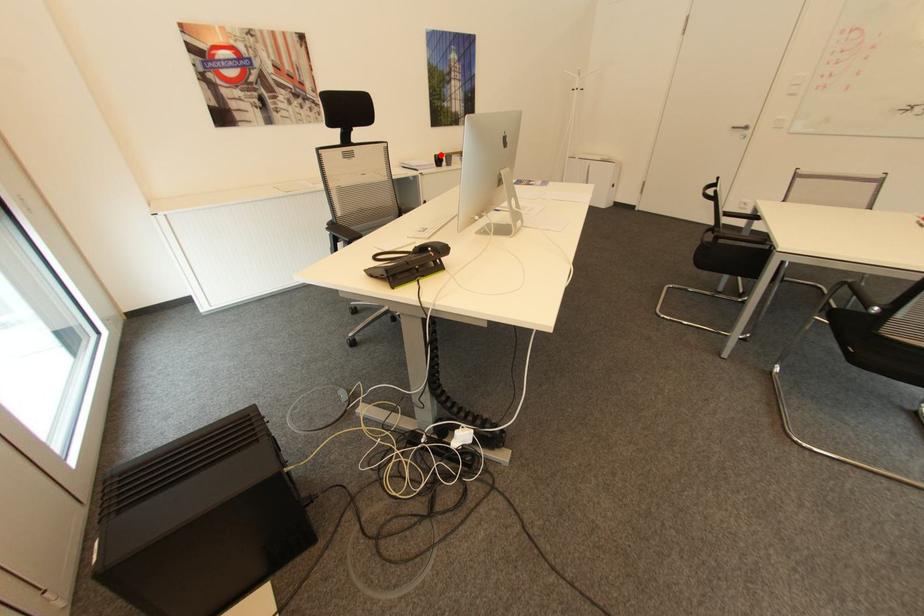
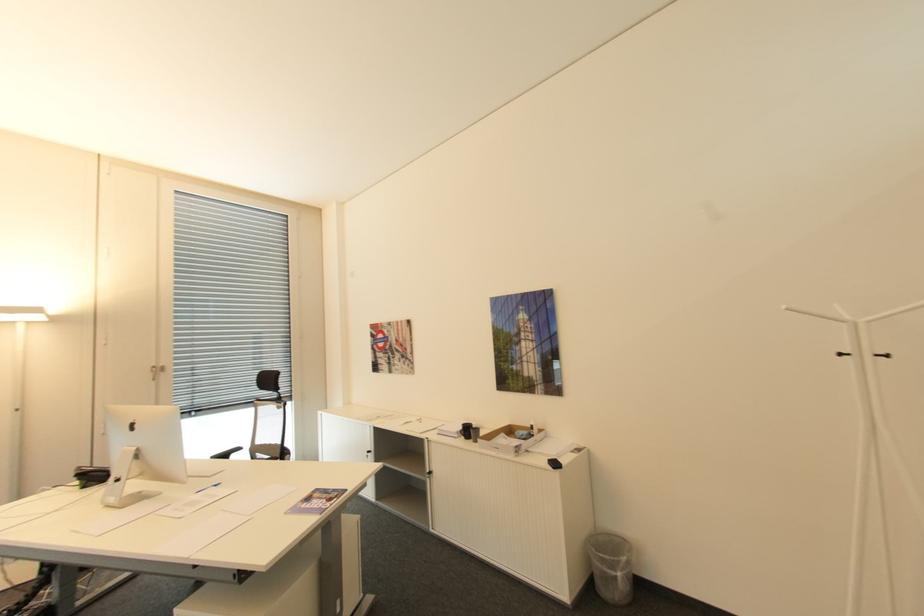
The point at the highlighted location is marked in the first image. Where is the corresponding point in the second image?

(468, 424)